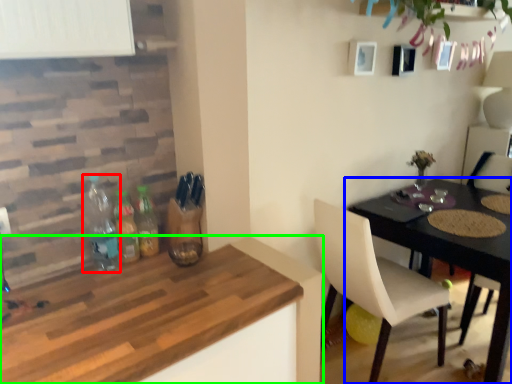
Question: Which object is positioned farthest from bottle (highlighted by a red box)? Select from table (highlighted by a blue box) and kitchen & dining room table (highlighted by a green box).

Choices:
 (A) table
 (B) kitchen & dining room table

Answer: (A)